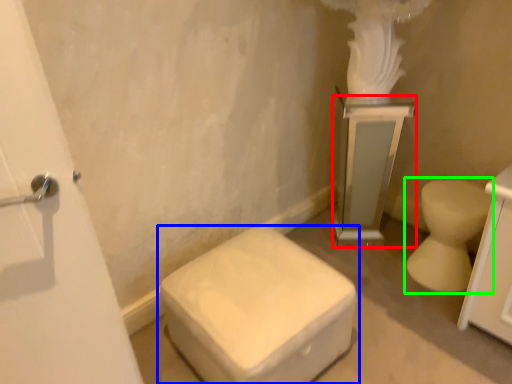
Question: Which is nearer to the medicine cabinet (highlighted by a red box)? toilet (highlighted by a blue box) or toilet (highlighted by a green box).

Choices:
 (A) toilet
 (B) toilet

Answer: (B)